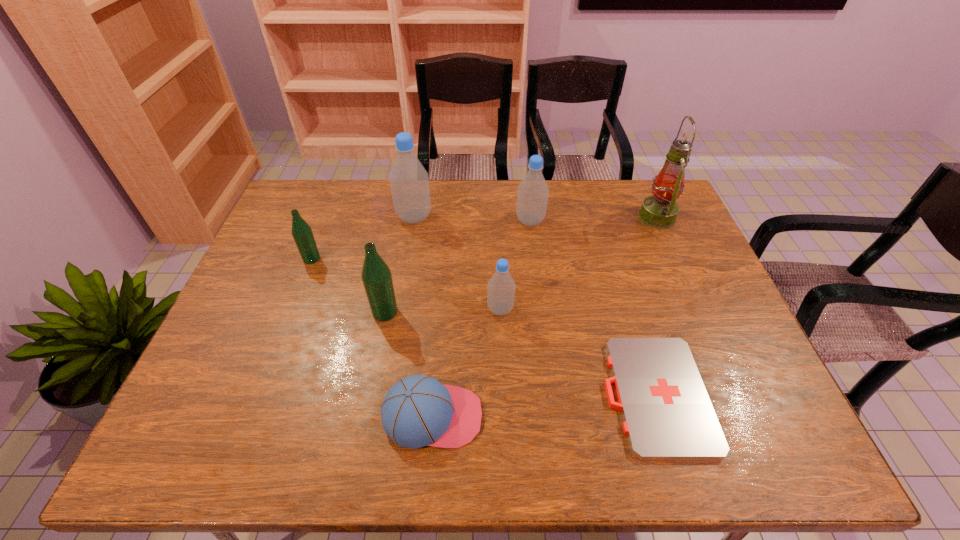
In order to click on the second closest object relative to the green oil lamp in this screenshot , I will do `click(667, 413)`.

Select which object is the sixth closest to the second object from right to left. Please provide its 2D coordinates. Your answer should be formatted as a tuple, i.e. [(x, y)], where the tuple contains the x and y coordinates of a point satisfying the conditions above.

[(409, 182)]

Select which bottle is the closest to the rightmost bottle. Please provide its 2D coordinates. Your answer should be formatted as a tuple, i.e. [(x, y)], where the tuple contains the x and y coordinates of a point satisfying the conditions above.

[(409, 182)]

Point out which bottle is positioned as the second nearest to the blue baseball cap. Please provide its 2D coordinates. Your answer should be formatted as a tuple, i.e. [(x, y)], where the tuple contains the x and y coordinates of a point satisfying the conditions above.

[(501, 287)]

The image size is (960, 540). In order to click on gray bottle that is the second closest to the baseball cap in this screenshot , I will do `click(409, 182)`.

Select which gray bottle appears as the third closest to the rightmost object. Please provide its 2D coordinates. Your answer should be formatted as a tuple, i.e. [(x, y)], where the tuple contains the x and y coordinates of a point satisfying the conditions above.

[(409, 182)]

Identify the location of free region that satisfies the following two spatial constraints: 1. on the back side of the fourth bottle from left to right; 2. on the left side of the rightmost bottle. (496, 221).

Find the location of a particular element. The image size is (960, 540). blank space that satisfies the following two spatial constraints: 1. on the back side of the green oil lamp; 2. on the right side of the leftmost bottle is located at coordinates (327, 218).